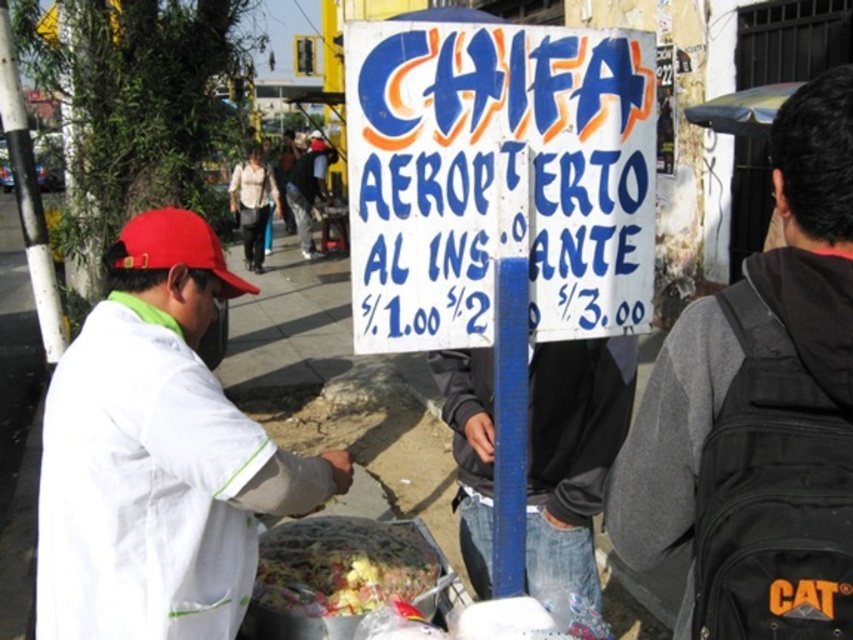
Question: Which of the following is the farthest from the observer?

Choices:
 (A) coord(256,452)
 (B) coord(721,372)

Answer: (A)

Question: Is shiny plastic container at center to the left of matte red cap at left from the viewer's perspective?

Choices:
 (A) no
 (B) yes

Answer: (A)

Question: Does dark gray hoodie at right have a smaller size compared to shiny plastic container at center?

Choices:
 (A) no
 (B) yes

Answer: (A)

Question: Does white cardboard sign at center come behind shiny plastic container at center?

Choices:
 (A) no
 (B) yes

Answer: (A)

Question: Which object is the farthest from the dark gray hoodie at right?

Choices:
 (A) shiny plastic container at center
 (B) white fabric jacket at left
 (C) white cardboard sign at center

Answer: (B)

Question: Estimate the real-world distances between objects in this image. Which object is farther from the shiny plastic container at center?

Choices:
 (A) white cardboard sign at center
 (B) matte red cap at left

Answer: (A)